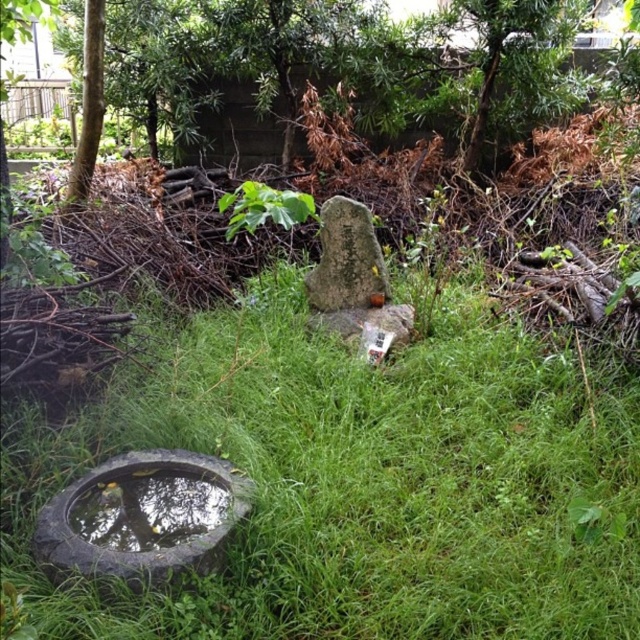
Question: Does green stone at center have a smaller size compared to green leafy plant at center?

Choices:
 (A) yes
 (B) no

Answer: (A)

Question: Which of the following is the farthest from the observer?

Choices:
 (A) (486, 552)
 (B) (92, 168)
 (C) (90, 502)

Answer: (B)

Question: Does dark gray rubber tire at lower left lie in front of reflective stone basin at lower left?

Choices:
 (A) no
 (B) yes

Answer: (B)

Question: Which point is closer to the camera?

Choices:
 (A) green stone at center
 (B) green grass at center
 (C) green leafy tree at upper left
 (D) dark gray rubber tire at lower left

Answer: (B)

Question: Does green grass at center appear under reflective stone basin at lower left?

Choices:
 (A) yes
 (B) no

Answer: (B)

Question: Among these points, which one is nearest to the camera?

Choices:
 (A) (92, 172)
 (B) (221, 515)

Answer: (B)